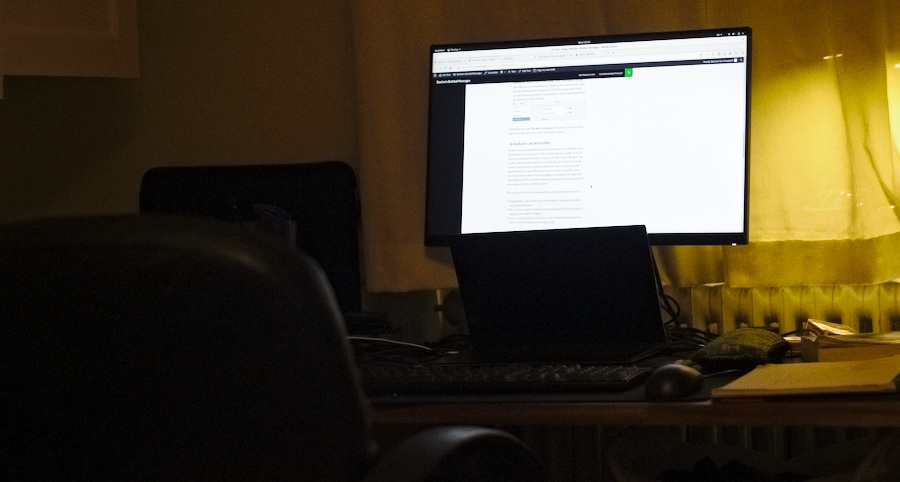
What are the coordinates of `desk` in the screenshot? It's located at (624, 412).